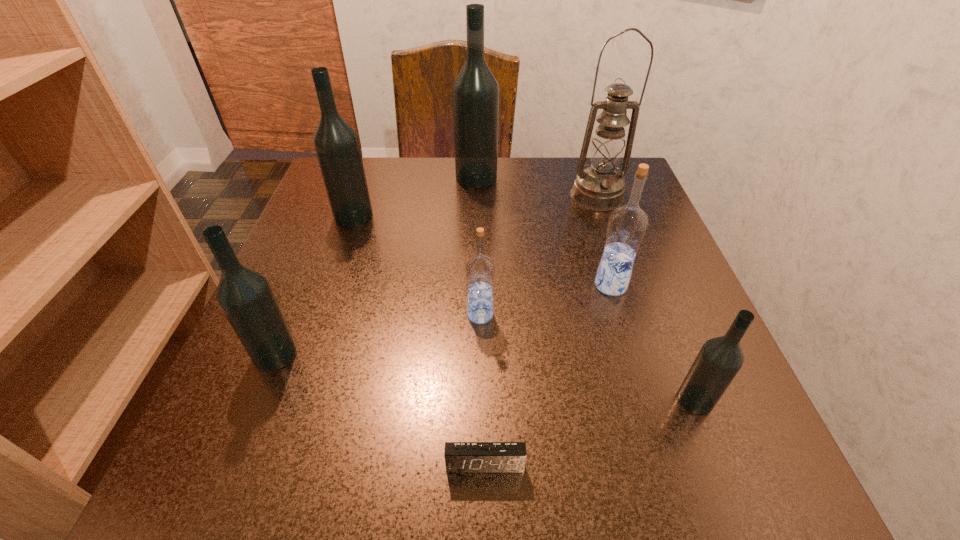
What are the coordinates of `the second black vodka from right to left` in the screenshot? It's located at (475, 93).

Locate an element on the screen. the farthest black vodka is located at coordinates (x=475, y=93).

The width and height of the screenshot is (960, 540). In order to click on oil lamp in this screenshot , I will do `click(599, 187)`.

Find the location of a particular element. the second farthest vodka is located at coordinates (336, 144).

Identify the location of the third smallest black vodka. (336, 144).

Locate an element on the screen. The image size is (960, 540). the fifth nearest object is located at coordinates (627, 225).

Find the location of a particular element. the second vodka from right to left is located at coordinates pos(627,225).

The height and width of the screenshot is (540, 960). What are the coordinates of `the third biggest black vodka` in the screenshot? It's located at (245, 296).

Identify the location of the sixth farthest object. Image resolution: width=960 pixels, height=540 pixels. (245, 296).

The image size is (960, 540). Identify the location of the left blue vodka. (480, 270).